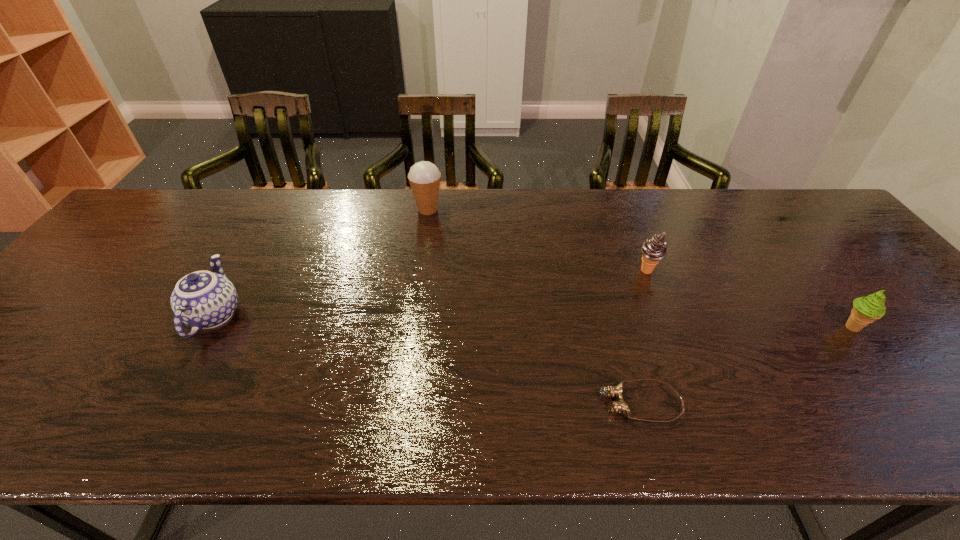
Locate an element on the screen. The height and width of the screenshot is (540, 960). the leftmost icecream is located at coordinates (424, 177).

I want to click on the tallest icecream, so click(424, 177).

At what (x,y) coordinates should I click in order to perform the action: click on the fourth nearest object. Please return your answer as a coordinate pair (x, y). The image size is (960, 540). Looking at the image, I should click on (654, 249).

The width and height of the screenshot is (960, 540). Identify the location of the second icecream from right to left. coord(654,249).

Locate an element on the screen. The image size is (960, 540). the leftmost object is located at coordinates (202, 300).

Locate an element on the screen. the rightmost icecream is located at coordinates (866, 310).

Identify the location of the rightmost object. (866, 310).

Image resolution: width=960 pixels, height=540 pixels. I want to click on the third object from left to right, so click(x=621, y=407).

This screenshot has height=540, width=960. Identify the location of the shortest object. (621, 407).

What are the coordinates of `vacant space situated 0.210m on the right of the farthest icecream` in the screenshot? It's located at (510, 210).